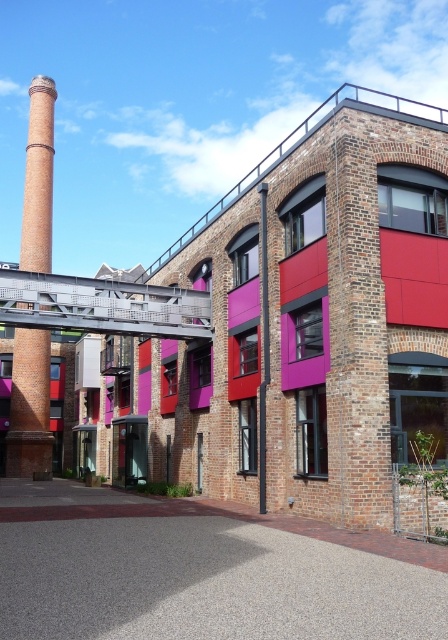
Between point (211, 417) and point (24, 394), which one is positioned in front?

Positioned in front is point (211, 417).

Is point (255, 387) positioned before point (48, 364)?

Yes, point (255, 387) is closer to viewer.

Find the location of a particular element. The width and height of the screenshot is (448, 640). brick building at center is located at coordinates click(281, 330).

Consider the image. Does brick building at center appear on the left side of brick at center?

Indeed, brick building at center is positioned on the left side of brick at center.

Which is more to the left, brick building at center or brick at center?

brick building at center is more to the left.

Is point (341, 515) positioned before point (339, 493)?

Yes, it is in front of point (339, 493).

I want to click on brick building at center, so click(x=281, y=330).

Between brick at center and brick chimney at left, which one has more height?

With more height is brick chimney at left.

Is brick at center to the right of brick chimney at left from the viewer's perspective?

Correct, you'll find brick at center to the right of brick chimney at left.

Where is `brick at center`? The height and width of the screenshot is (640, 448). brick at center is located at coordinates (357, 344).

This screenshot has height=640, width=448. Identify the location of brick at center. (357, 344).